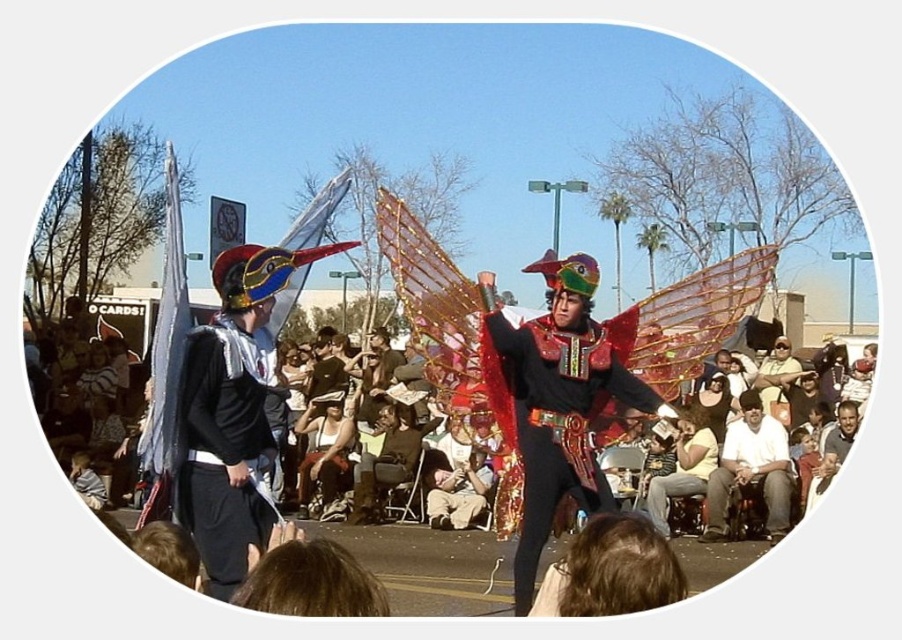
Between point (588, 445) and point (788, 483), which one is positioned in front?

Point (588, 445) is more forward.

Is point (610, 337) behind point (756, 472)?

That is False.

Where is `shiny metallic wings at center`? This screenshot has width=902, height=640. shiny metallic wings at center is located at coordinates (559, 410).

The width and height of the screenshot is (902, 640). I want to click on shiny metallic wings at center, so click(559, 410).

Does point (540, 481) come closer to viewer compared to point (208, 492)?

No, it is behind (208, 492).

In the scene shown: Is shiny metallic wings at center wider than matte black cape at center?

Indeed, shiny metallic wings at center has a greater width compared to matte black cape at center.

Does point (517, 579) come behind point (221, 506)?

Yes, point (517, 579) is behind point (221, 506).

The width and height of the screenshot is (902, 640). Identify the location of shiny metallic wings at center. (559, 410).

Does matte black cape at center appear on the right side of white cotton shirt at lower right?

In fact, matte black cape at center is to the left of white cotton shirt at lower right.

Does matte black cape at center have a smaller size compared to white cotton shirt at lower right?

No.

Image resolution: width=902 pixels, height=640 pixels. What are the coordinates of `matte black cape at center` in the screenshot? It's located at (226, 444).